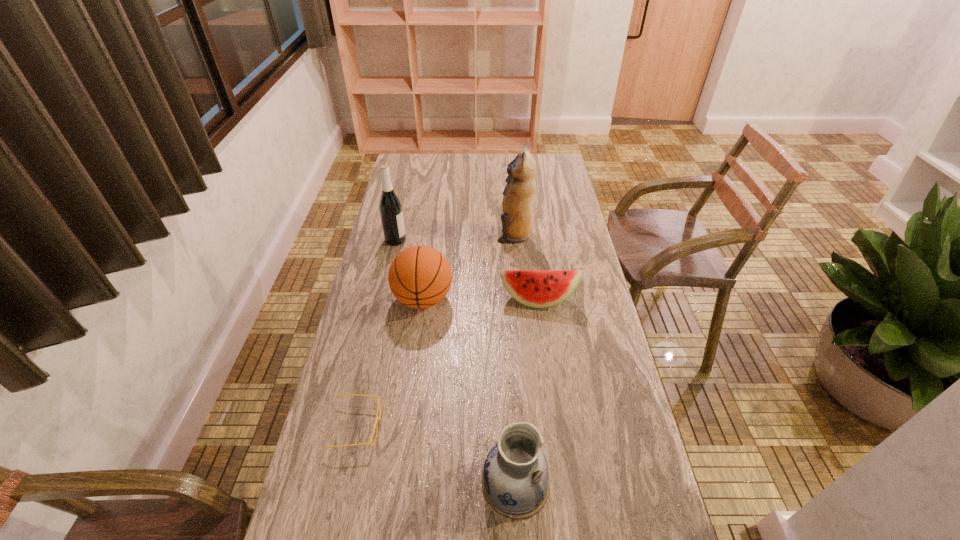
Image resolution: width=960 pixels, height=540 pixels. What are the coordinates of `object that is the fifth nearest to the pottery` in the screenshot? It's located at (390, 207).

Identify the location of the third closest object to the pottery. This screenshot has height=540, width=960. (535, 288).

At what (x,y) coordinates should I click in order to perform the action: click on vacant point that satisfies the following two spatial constraints: 1. in front of the lenses of the shortest object; 2. on the right side of the pottery. Please return your answer as a coordinate pair (x, y). Looking at the image, I should click on (344, 483).

Where is `free spot that satisfies the following two spatial constraints: 1. on the back side of the pottery; 2. on the label of the fifth shortest object`? The image size is (960, 540). free spot that satisfies the following two spatial constraints: 1. on the back side of the pottery; 2. on the label of the fifth shortest object is located at coordinates (501, 240).

Where is `vacant region that satisfies the following two spatial constraints: 1. on the back side of the basketball; 2. on the label of the wine bottle`? vacant region that satisfies the following two spatial constraints: 1. on the back side of the basketball; 2. on the label of the wine bottle is located at coordinates (431, 240).

Find the location of a particular element. This screenshot has height=540, width=960. free point that satisfies the following two spatial constraints: 1. on the outer rind of the watermelon; 2. in front of the lenses of the shortest object is located at coordinates (554, 427).

I want to click on vacant space that satisfies the following two spatial constraints: 1. on the back side of the pottery; 2. in front of the lenses of the shortest object, so click(x=512, y=427).